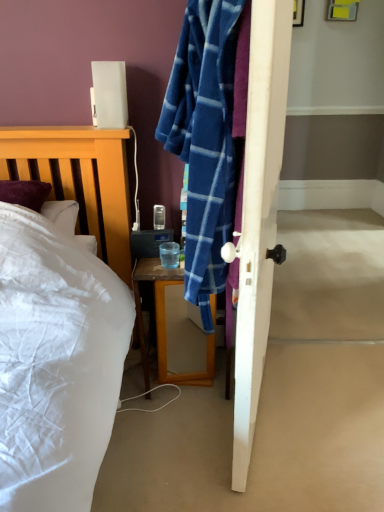
Question: Considering the relative sizes of wooden desk at center and transparent glass at bedside in the image provided, is wooden desk at center wider than transparent glass at bedside?

Choices:
 (A) no
 (B) yes

Answer: (B)

Question: Is wooden desk at center outside transparent glass at bedside?

Choices:
 (A) yes
 (B) no

Answer: (A)

Question: Is the surface of wooden desk at center in direct contact with transparent glass at bedside?

Choices:
 (A) yes
 (B) no

Answer: (B)

Question: Is wooden desk at center shorter than transparent glass at bedside?

Choices:
 (A) no
 (B) yes

Answer: (A)

Question: Is wooden desk at center at the left side of transparent glass at bedside?

Choices:
 (A) no
 (B) yes

Answer: (A)

Question: Is wooden desk at center wider or thinner than transparent glass at bedside?

Choices:
 (A) thin
 (B) wide

Answer: (B)

Question: Would you say wooden desk at center is to the left or to the right of transparent glass at bedside in the picture?

Choices:
 (A) left
 (B) right

Answer: (B)

Question: Considering the positions of point (173, 376) and point (168, 265), is point (173, 376) closer or farther from the camera than point (168, 265)?

Choices:
 (A) farther
 (B) closer

Answer: (A)

Question: Is wooden desk at center inside or outside of transparent glass at bedside?

Choices:
 (A) inside
 (B) outside

Answer: (B)

Question: Is wooden desk at center taller or shorter than yellow plastic picture frame at upper right?

Choices:
 (A) short
 (B) tall

Answer: (B)

Question: Would you say wooden desk at center is inside or outside yellow plastic picture frame at upper right?

Choices:
 (A) outside
 (B) inside

Answer: (A)

Question: Is wooden desk at center wider or thinner than yellow plastic picture frame at upper right?

Choices:
 (A) wide
 (B) thin

Answer: (A)

Question: Considering their positions, is wooden desk at center located in front of or behind yellow plastic picture frame at upper right?

Choices:
 (A) front
 (B) behind

Answer: (A)

Question: In terms of height, does transparent glass at bedside look taller or shorter compared to yellow plastic picture frame at upper right?

Choices:
 (A) short
 (B) tall

Answer: (A)

Question: Is transparent glass at bedside spatially inside yellow plastic picture frame at upper right, or outside of it?

Choices:
 (A) inside
 (B) outside

Answer: (B)